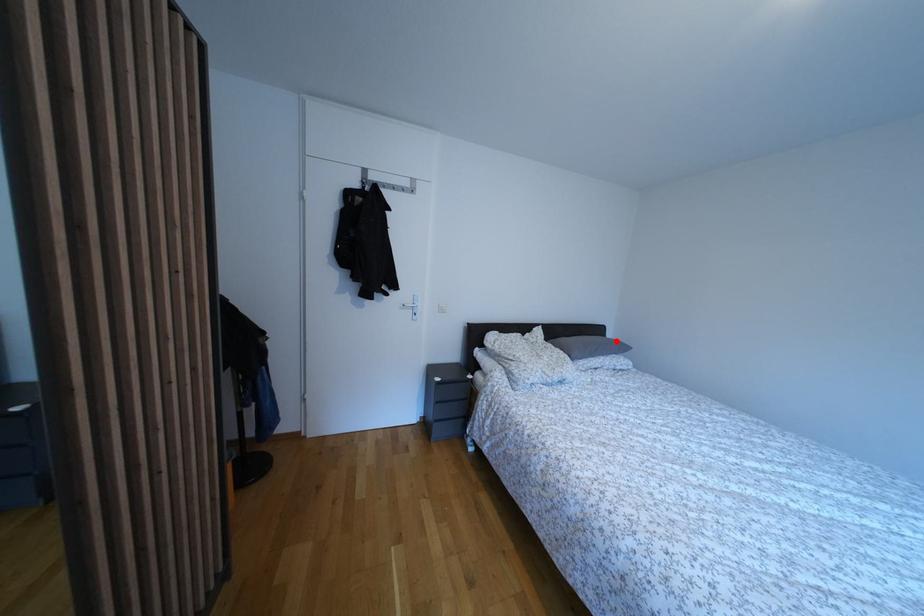
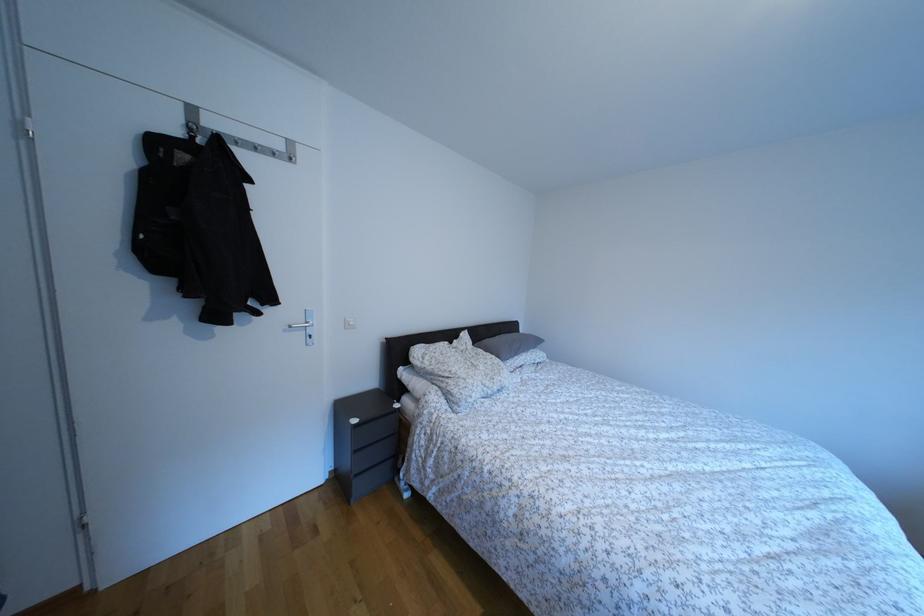
In the second image, find the point that corresponds to the highlighted location in the first image.

(529, 336)